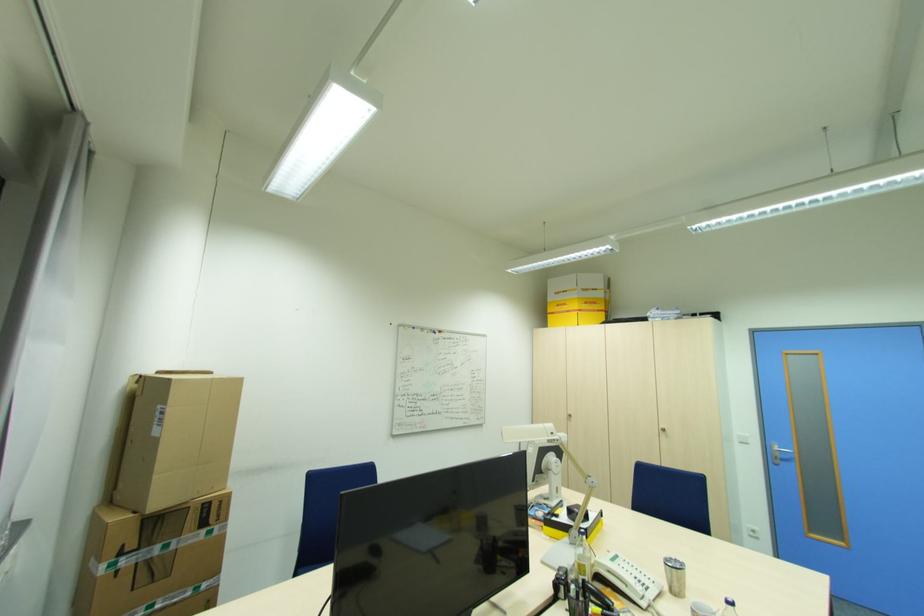
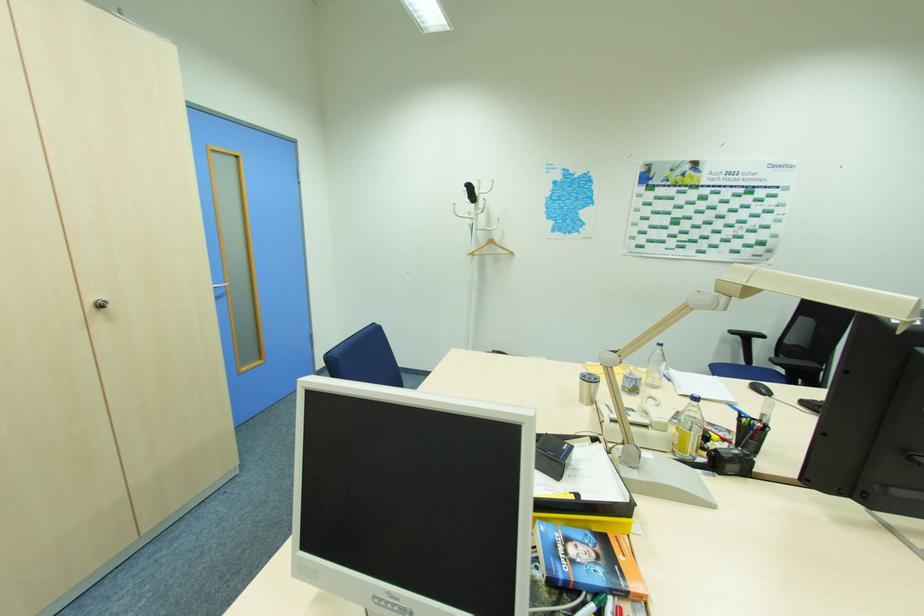
Locate, in the second image, the point that corresponds to point 666,430 in the first image.

(103, 306)